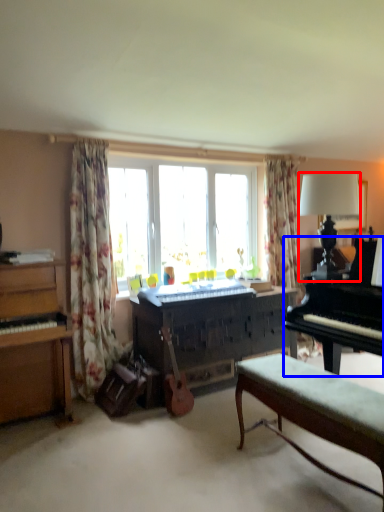
Question: Which object is further to the camera taking this photo, lamp (highlighted by a red box) or piano (highlighted by a blue box)?

Choices:
 (A) lamp
 (B) piano

Answer: (A)